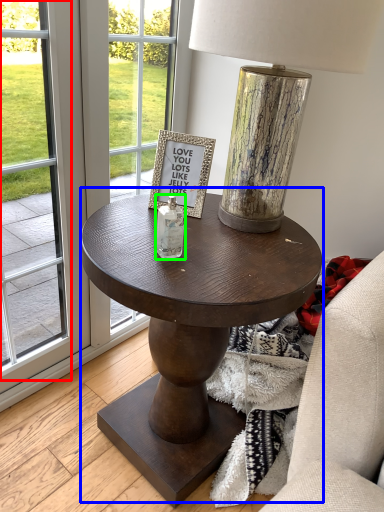
Question: Which object is the farthest from screen door (highlighted by a red box)? Choose among these: coffee table (highlighted by a blue box) or bottle (highlighted by a green box).

Choices:
 (A) coffee table
 (B) bottle

Answer: (B)